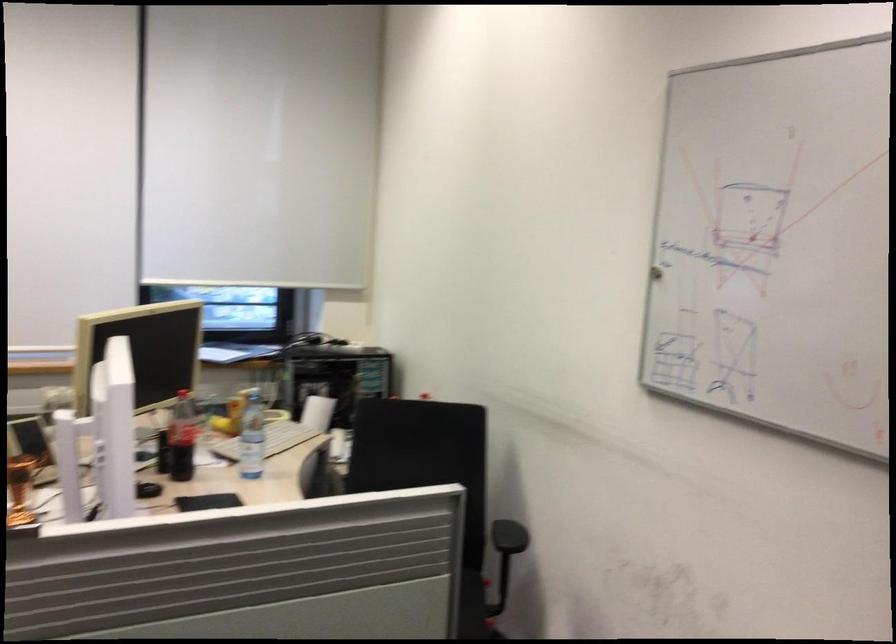
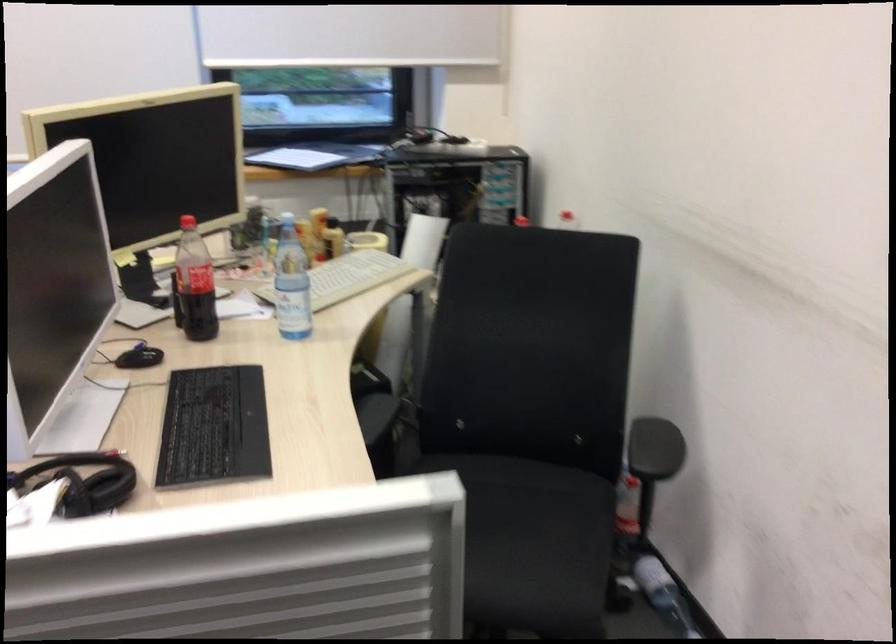
Question: What movement of the cameraman would produce the second image?

Choices:
 (A) Left
 (B) Right
 (C) Forward
 (D) Backward

Answer: (C)